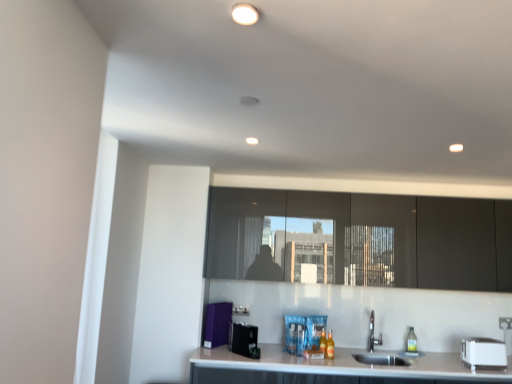
Question: Is white plastic toaster at lower right, the 1th appliance when ordered from right to left, to the right of matte black cabinets at center from the viewer's perspective?

Choices:
 (A) yes
 (B) no

Answer: (A)

Question: Can you confirm if white plastic toaster at lower right, the 1th appliance when ordered from right to left, is wider than matte black cabinets at center?

Choices:
 (A) yes
 (B) no

Answer: (B)

Question: Is white plastic toaster at lower right, the 1th appliance when ordered from right to left, positioned before matte black cabinets at center?

Choices:
 (A) no
 (B) yes

Answer: (B)

Question: Does white plastic toaster at lower right, the 1th appliance when ordered from right to left, have a smaller size compared to matte black cabinets at center?

Choices:
 (A) no
 (B) yes

Answer: (B)

Question: Could matte black cabinets at center be considered to be inside white plastic toaster at lower right, arranged as the 3th appliance when viewed from the left?

Choices:
 (A) yes
 (B) no

Answer: (B)

Question: Do you think translucent plastic bottle at lower center, the first bottle positioned from the back, is within white glossy light fixture at upper center, or outside of it?

Choices:
 (A) outside
 (B) inside

Answer: (A)

Question: Is translucent plastic bottle at lower center, the first bottle positioned from the back, in front of or behind white glossy light fixture at upper center in the image?

Choices:
 (A) front
 (B) behind

Answer: (B)

Question: From the image's perspective, is translucent plastic bottle at lower center, the second bottle positioned from the front, positioned above or below white glossy light fixture at upper center?

Choices:
 (A) above
 (B) below

Answer: (B)

Question: Considering the positions of translucent plastic bottle at lower center, the second bottle positioned from the front, and white glossy light fixture at upper center in the image, is translucent plastic bottle at lower center, the second bottle positioned from the front, wider or thinner than white glossy light fixture at upper center?

Choices:
 (A) wide
 (B) thin

Answer: (B)

Question: Is translucent plastic bottle at sink right to the left or to the right of white plastic toaster at lower right, arranged as the 3th appliance when viewed from the left, in the image?

Choices:
 (A) right
 (B) left

Answer: (B)

Question: In terms of height, does translucent plastic bottle at sink right look taller or shorter compared to white plastic toaster at lower right, arranged as the 3th appliance when viewed from the left?

Choices:
 (A) tall
 (B) short

Answer: (A)

Question: Is translucent plastic bottle at sink right in front of or behind white plastic toaster at lower right, the 1th appliance when ordered from right to left, in the image?

Choices:
 (A) behind
 (B) front

Answer: (A)

Question: Considering the positions of point (411, 342) and point (499, 349), is point (411, 342) closer or farther from the camera than point (499, 349)?

Choices:
 (A) farther
 (B) closer

Answer: (A)

Question: From a real-world perspective, relative to white plastic toaster at lower right, the 1th appliance when ordered from right to left, is matte black cabinets at center vertically above or below?

Choices:
 (A) below
 (B) above

Answer: (B)

Question: Considering their positions, is matte black cabinets at center located in front of or behind white plastic toaster at lower right, arranged as the 3th appliance when viewed from the left?

Choices:
 (A) behind
 (B) front

Answer: (A)